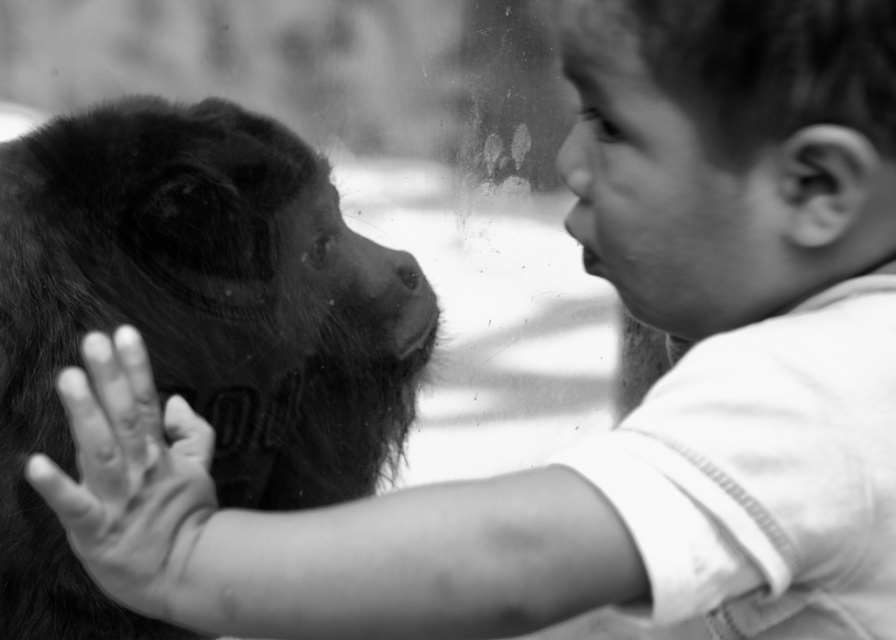
Who is shorter, black furry monkey at left or smooth skin hand at center?

With less height is smooth skin hand at center.

Is point (24, 563) positioned in front of point (169, 534)?

No.

Which is behind, point (117, 259) or point (32, 474)?

Point (117, 259)

Locate an element on the screen. This screenshot has width=896, height=640. black furry monkey at left is located at coordinates (192, 323).